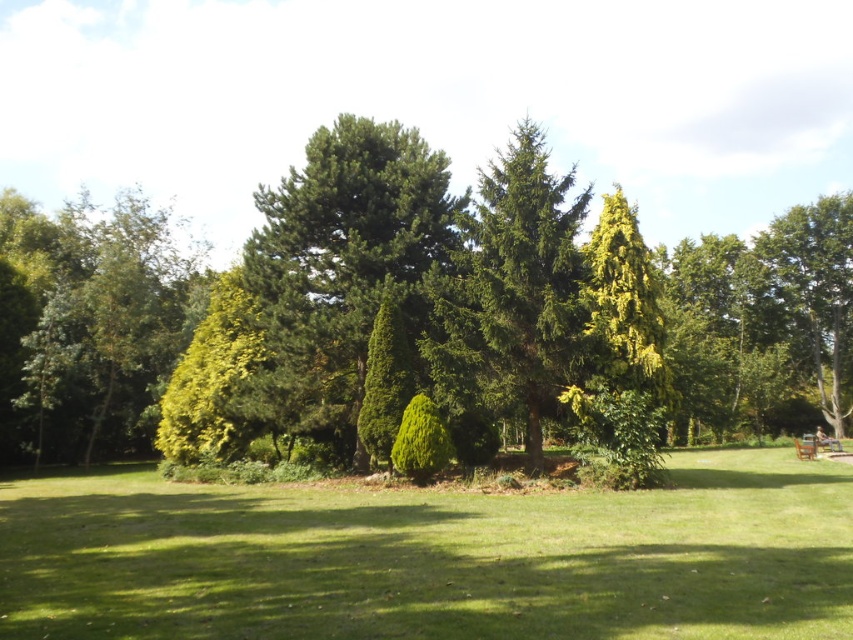
Who is taller, green leafy tree at left or green textured tree at center?

green textured tree at center is taller.

Can you confirm if green leafy tree at left is positioned to the right of green textured tree at center?

No, green leafy tree at left is not to the right of green textured tree at center.

Is point (132, 356) in front of point (477, 180)?

Yes, it is.

The height and width of the screenshot is (640, 853). In order to click on green leafy tree at left in this screenshot , I will do `click(96, 321)`.

Which is in front, point (490, 321) or point (566, 554)?

Positioned in front is point (566, 554).

At what (x,y) coordinates should I click in order to perform the action: click on green leafy tree at center. Please return your answer as a coordinate pair (x, y). This screenshot has width=853, height=640. Looking at the image, I should click on (410, 284).

The image size is (853, 640). In order to click on green leafy tree at center in this screenshot , I will do `click(410, 284)`.

Does point (505, 305) lie behind point (844, 330)?

No, it is in front of (844, 330).

Looking at this image, between green textured tree at center and green leafy tree at right, which one has more height?

green textured tree at center

Image resolution: width=853 pixels, height=640 pixels. Find the location of `green textured tree at center`. green textured tree at center is located at coordinates (514, 289).